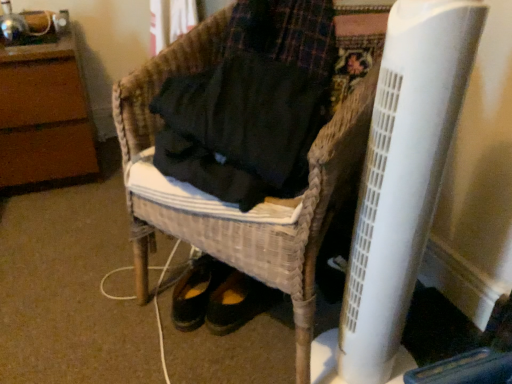
Locate an element on the screen. This screenshot has height=384, width=512. brown wood dresser at upper left, positioned as the second furniture in front-to-back order is located at coordinates (44, 115).

In order to face woven wicker chair at center, arranged as the 2th furniture when viewed from the left, should I rotate leftwards or rightwards?

You should rotate right by 2.041 degrees.

Find the location of a particular element. This screenshot has height=384, width=512. brown wood dresser at upper left, positioned as the second furniture in front-to-back order is located at coordinates tap(44, 115).

Which is behind, point (307, 325) or point (24, 175)?

The point (24, 175) is farther.

Consider the image. From the image's perspective, does woven wicker chair at center, which appears as the 1th furniture when viewed from the right, appear lower than brown wood dresser at upper left, the first furniture in the left-to-right sequence?

Correct, woven wicker chair at center, which appears as the 1th furniture when viewed from the right, appears lower than brown wood dresser at upper left, the first furniture in the left-to-right sequence, in the image.

Looking at this image, considering the positions of objects woven wicker chair at center, which ranks as the first furniture in front-to-back order, and brown wood dresser at upper left, the first furniture in the left-to-right sequence, in the image provided, who is in front, woven wicker chair at center, which ranks as the first furniture in front-to-back order, or brown wood dresser at upper left, the first furniture in the left-to-right sequence,?

Positioned in front is woven wicker chair at center, which ranks as the first furniture in front-to-back order.

Can you tell me how much woven wicker chair at center, marked as the 2th furniture in a back-to-front arrangement, and brown wood dresser at upper left, positioned as the first furniture in back-to-front order, differ in facing direction?

They differ by 60.5 degrees in their facing directions.

Relative to woven wicker chair at center, which appears as the 1th furniture when viewed from the right, is white plastic radiator at lower right in front or behind?

white plastic radiator at lower right is positioned closer to the viewer than woven wicker chair at center, which appears as the 1th furniture when viewed from the right.

Between white plastic radiator at lower right and woven wicker chair at center, which appears as the 1th furniture when viewed from the right, which one appears on the left side from the viewer's perspective?

woven wicker chair at center, which appears as the 1th furniture when viewed from the right.

Is white plastic radiator at lower right oriented towards woven wicker chair at center, which ranks as the first furniture in front-to-back order?

Yes, white plastic radiator at lower right is facing woven wicker chair at center, which ranks as the first furniture in front-to-back order.

From their relative heights in the image, would you say white plastic radiator at lower right is taller or shorter than woven wicker chair at center, marked as the 2th furniture in a back-to-front arrangement?

Clearly, white plastic radiator at lower right is taller compared to woven wicker chair at center, marked as the 2th furniture in a back-to-front arrangement.

Between point (59, 171) and point (408, 126), which one is positioned in front?

The point (408, 126) is more forward.

Does brown wood dresser at upper left, positioned as the second furniture in right-to-left order, contain white plastic radiator at lower right?

No.

Where is `the 2nd furniture behind the white plastic radiator at lower right`? Image resolution: width=512 pixels, height=384 pixels. the 2nd furniture behind the white plastic radiator at lower right is located at coordinates (44, 115).

Measure the distance between brown wood dresser at upper left, positioned as the second furniture in front-to-back order, and white plastic radiator at lower right.

brown wood dresser at upper left, positioned as the second furniture in front-to-back order, is 4.21 feet from white plastic radiator at lower right.

From a real-world perspective, is woven wicker chair at center, arranged as the 2th furniture when viewed from the left, positioned over white plastic radiator at lower right based on gravity?

No, from a real-world perspective, woven wicker chair at center, arranged as the 2th furniture when viewed from the left, is not over white plastic radiator at lower right

The image size is (512, 384). What are the coordinates of `radiator on the right of the woven wicker chair at center, which ranks as the first furniture in front-to-back order` in the screenshot? It's located at (403, 175).

Is point (328, 175) farther from viewer compared to point (412, 150)?

Yes, it is.

Choose the correct answer: Is woven wicker chair at center, which ranks as the first furniture in front-to-back order, inside white plastic radiator at lower right or outside it?

woven wicker chair at center, which ranks as the first furniture in front-to-back order, is located beyond the bounds of white plastic radiator at lower right.

Is white plastic radiator at lower right facing towards brown wood dresser at upper left, positioned as the second furniture in right-to-left order?

No, white plastic radiator at lower right is not aimed at brown wood dresser at upper left, positioned as the second furniture in right-to-left order.

Does white plastic radiator at lower right have a larger size compared to brown wood dresser at upper left, positioned as the first furniture in back-to-front order?

No, white plastic radiator at lower right is not bigger than brown wood dresser at upper left, positioned as the first furniture in back-to-front order.

From a real-world perspective, who is located lower, white plastic radiator at lower right or brown wood dresser at upper left, positioned as the second furniture in front-to-back order?

brown wood dresser at upper left, positioned as the second furniture in front-to-back order, is physically lower.

Is point (391, 190) more distant than point (78, 126)?

No.

From a real-world perspective, between brown wood dresser at upper left, positioned as the first furniture in back-to-front order, and woven wicker chair at center, which appears as the 1th furniture when viewed from the right, who is vertically lower?

In real-world perspective, brown wood dresser at upper left, positioned as the first furniture in back-to-front order, is lower.

From their relative heights in the image, would you say brown wood dresser at upper left, positioned as the second furniture in front-to-back order, is taller or shorter than woven wicker chair at center, which appears as the 1th furniture when viewed from the right?

Clearly, brown wood dresser at upper left, positioned as the second furniture in front-to-back order, is shorter compared to woven wicker chair at center, which appears as the 1th furniture when viewed from the right.

Could woven wicker chair at center, arranged as the 2th furniture when viewed from the left, be considered to be inside brown wood dresser at upper left, the first furniture in the left-to-right sequence?

That's incorrect, woven wicker chair at center, arranged as the 2th furniture when viewed from the left, is not inside brown wood dresser at upper left, the first furniture in the left-to-right sequence.

Where is `furniture directly beneath the woven wicker chair at center, arranged as the 2th furniture when viewed from the left (from a real-world perspective)`? furniture directly beneath the woven wicker chair at center, arranged as the 2th furniture when viewed from the left (from a real-world perspective) is located at coordinates (44, 115).

At what (x,y) coordinates should I click in order to perform the action: click on radiator above the woven wicker chair at center, which appears as the 1th furniture when viewed from the right (from a real-world perspective). Please return your answer as a coordinate pair (x, y). Image resolution: width=512 pixels, height=384 pixels. Looking at the image, I should click on (403, 175).

Considering their positions, is white plastic radiator at lower right positioned further to brown wood dresser at upper left, positioned as the second furniture in right-to-left order, than woven wicker chair at center, which ranks as the first furniture in front-to-back order?

white plastic radiator at lower right lies further to brown wood dresser at upper left, positioned as the second furniture in right-to-left order, than the other object.

From the image, which object appears to be farther from woven wicker chair at center, arranged as the 2th furniture when viewed from the left, brown wood dresser at upper left, positioned as the second furniture in front-to-back order, or white plastic radiator at lower right?

Based on the image, brown wood dresser at upper left, positioned as the second furniture in front-to-back order, appears to be further to woven wicker chair at center, arranged as the 2th furniture when viewed from the left.

Based on their spatial positions, is woven wicker chair at center, which appears as the 1th furniture when viewed from the right, or white plastic radiator at lower right further from brown wood dresser at upper left, the first furniture in the left-to-right sequence?

The object further to brown wood dresser at upper left, the first furniture in the left-to-right sequence, is white plastic radiator at lower right.

When comparing their distances from woven wicker chair at center, which ranks as the first furniture in front-to-back order, does white plastic radiator at lower right or brown wood dresser at upper left, the first furniture in the left-to-right sequence, seem further?

brown wood dresser at upper left, the first furniture in the left-to-right sequence, is further to woven wicker chair at center, which ranks as the first furniture in front-to-back order.

From the picture: Based on their spatial positions, is brown wood dresser at upper left, positioned as the first furniture in back-to-front order, or woven wicker chair at center, arranged as the 2th furniture when viewed from the left, further from white plastic radiator at lower right?

brown wood dresser at upper left, positioned as the first furniture in back-to-front order, is positioned further to the anchor white plastic radiator at lower right.

When comparing their distances from white plastic radiator at lower right, does woven wicker chair at center, marked as the 2th furniture in a back-to-front arrangement, or brown wood dresser at upper left, positioned as the second furniture in right-to-left order, seem closer?

woven wicker chair at center, marked as the 2th furniture in a back-to-front arrangement, is closer to white plastic radiator at lower right.

The image size is (512, 384). What are the coordinates of `furniture between brown wood dresser at upper left, positioned as the first furniture in back-to-front order, and white plastic radiator at lower right, in the horizontal direction` in the screenshot? It's located at (242, 222).